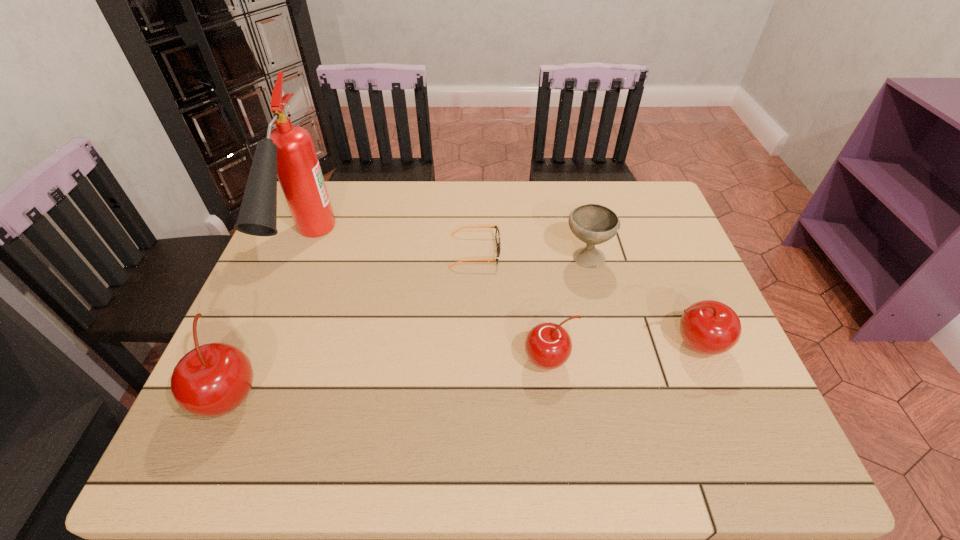
If we want them evenly spaced by inserting an extra cherry among them, please locate a free spot for this new cherry. Please provide its 2D coordinates. Your answer should be formatted as a tuple, i.e. [(x, y)], where the tuple contains the x and y coordinates of a point satisfying the conditions above.

[(395, 376)]